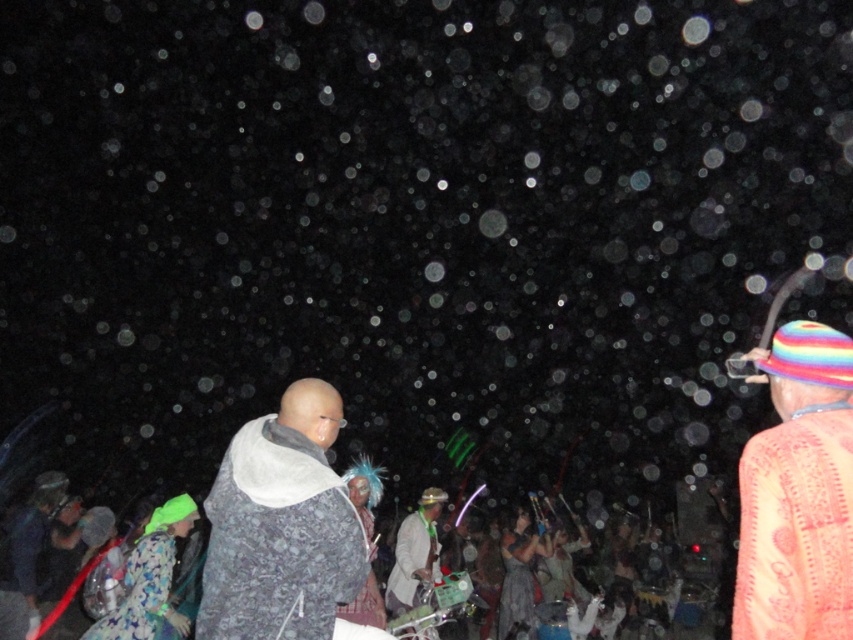
Which is above, fluffy white scarf at center or white textured jacket at center?

fluffy white scarf at center is higher up.

Which is behind, point (328, 570) or point (405, 589)?

The point (405, 589) is behind.

You are a GUI agent. You are given a task and a screenshot of the screen. Output one action in this format:
    pyautogui.click(x=<x>, y=<y>)
    Task: Click on the fluffy white scarf at center
    
    Given the screenshot: What is the action you would take?
    pyautogui.click(x=281, y=525)

Who is more distant from viewer, (x=798, y=468) or (x=395, y=584)?

Point (x=395, y=584)

Between multicolored fabric hat at right and white textured jacket at center, which one has more height?

white textured jacket at center is taller.

Where is `multicolored fabric hat at right`? The image size is (853, 640). multicolored fabric hat at right is located at coordinates (x=798, y=493).

Which is more to the right, fluffy white scarf at center or multicolored fabric hat at right?

From the viewer's perspective, multicolored fabric hat at right appears more on the right side.

Does point (254, 547) come closer to viewer compared to point (793, 563)?

That is False.

In order to click on fluffy white scarf at center in this screenshot , I will do `click(281, 525)`.